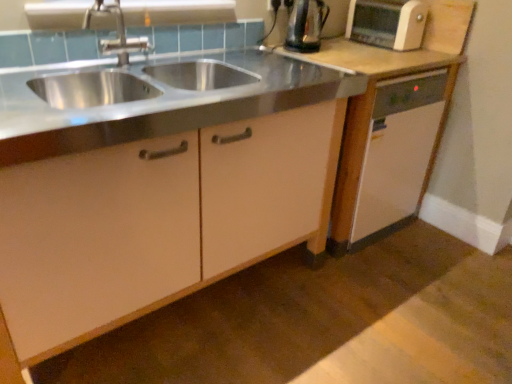
Question: Does white matte dishwasher at right, arranged as the second cabinetry when viewed from the left, have a greater height compared to metallic silver kettle at upper right?

Choices:
 (A) no
 (B) yes

Answer: (B)

Question: Is white matte dishwasher at right, the 1th cabinetry viewed from the right, thinner than metallic silver kettle at upper right?

Choices:
 (A) yes
 (B) no

Answer: (B)

Question: Considering the relative sizes of white matte dishwasher at right, arranged as the second cabinetry when viewed from the left, and metallic silver kettle at upper right in the image provided, is white matte dishwasher at right, arranged as the second cabinetry when viewed from the left, bigger than metallic silver kettle at upper right?

Choices:
 (A) yes
 (B) no

Answer: (A)

Question: Is white matte dishwasher at right, the 1th cabinetry viewed from the right, in front of metallic silver kettle at upper right?

Choices:
 (A) yes
 (B) no

Answer: (A)

Question: Is white matte dishwasher at right, arranged as the second cabinetry when viewed from the left, far from metallic silver kettle at upper right?

Choices:
 (A) yes
 (B) no

Answer: (B)

Question: Considering the relative positions of white matte dishwasher at right, the 1th cabinetry viewed from the right, and metallic silver kettle at upper right in the image provided, is white matte dishwasher at right, the 1th cabinetry viewed from the right, behind metallic silver kettle at upper right?

Choices:
 (A) no
 (B) yes

Answer: (A)

Question: Is white matte dishwasher at right, the 1th cabinetry viewed from the right, at the right side of white plastic electric outlet at center?

Choices:
 (A) no
 (B) yes

Answer: (B)

Question: Is white matte dishwasher at right, the 1th cabinetry viewed from the right, located outside white plastic electric outlet at center?

Choices:
 (A) yes
 (B) no

Answer: (A)

Question: Is white matte dishwasher at right, arranged as the second cabinetry when viewed from the left, far from white plastic electric outlet at center?

Choices:
 (A) yes
 (B) no

Answer: (B)

Question: Does white matte dishwasher at right, the 1th cabinetry viewed from the right, have a lesser width compared to white plastic electric outlet at center?

Choices:
 (A) no
 (B) yes

Answer: (A)

Question: Does white matte dishwasher at right, the 1th cabinetry viewed from the right, come in front of white plastic electric outlet at center?

Choices:
 (A) yes
 (B) no

Answer: (A)

Question: From a real-world perspective, does white matte dishwasher at right, arranged as the second cabinetry when viewed from the left, stand above white plastic electric outlet at center?

Choices:
 (A) yes
 (B) no

Answer: (B)

Question: Can you confirm if brushed metal faucet at upper left is taller than matte white cabinet at center, marked as the second cabinetry in a right-to-left arrangement?

Choices:
 (A) no
 (B) yes

Answer: (A)